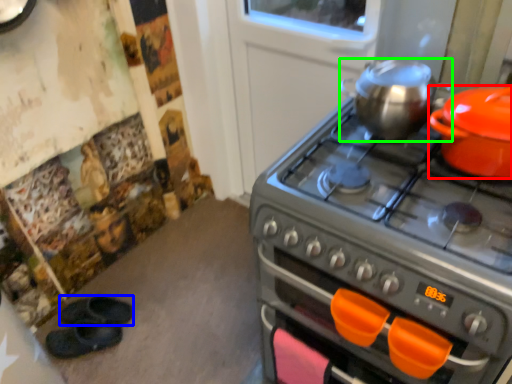
Question: Which object is positioned farthest from kitchen appliance (highlighted by a red box)? Select from footwear (highlighted by a blue box) and kitchen appliance (highlighted by a green box).

Choices:
 (A) footwear
 (B) kitchen appliance

Answer: (A)